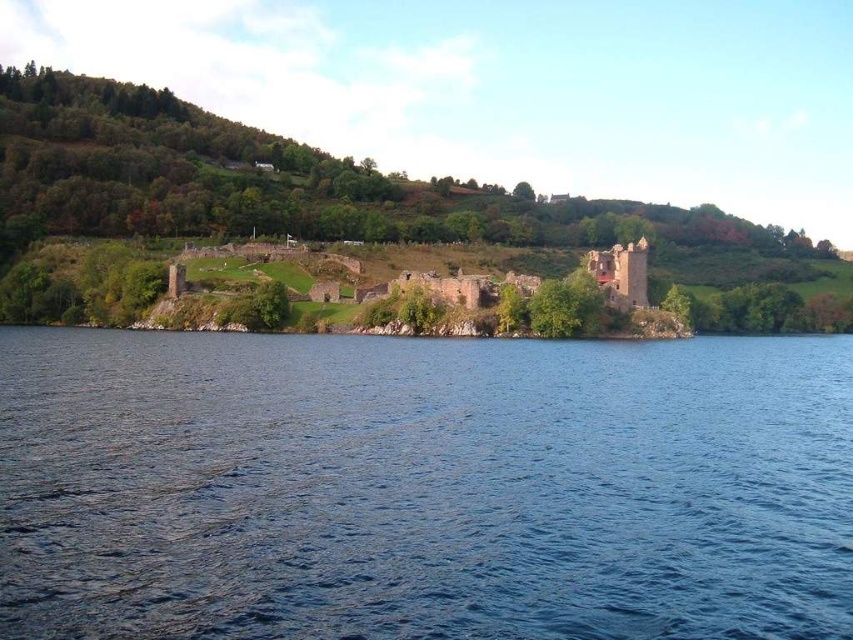
You are standing at the edge of the water and want to reach the green grassy hillside at upper center. Which direction should you head towards?

The green grassy hillside at upper center is located at point coordinates, so you should head towards the upper center direction to reach it.